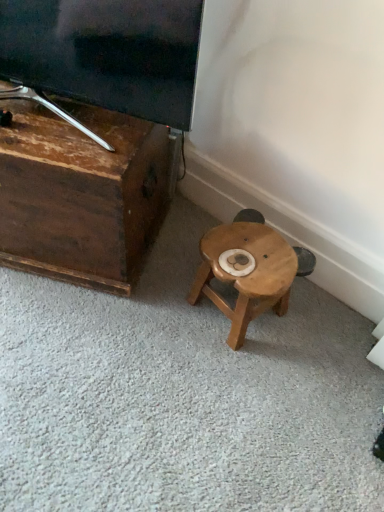
I want to click on empty space that is ontop of wooden stool at center, so pos(253,253).